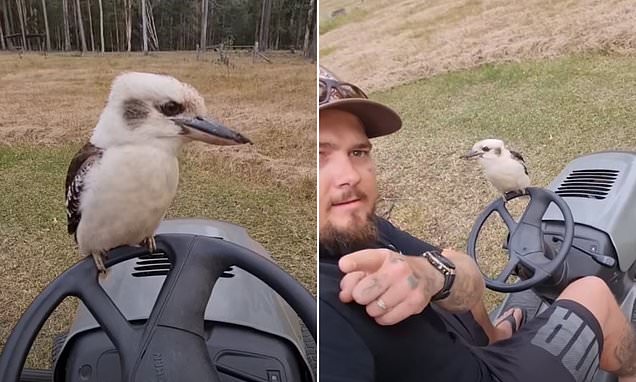
You are a GUI agent. You are given a task and a screenshot of the screen. Output one action in this format:
    pyautogui.click(x=<x>, y=<y>)
    Task: Click on the white border between picitures
    
    Given the screenshot: What is the action you would take?
    pyautogui.click(x=314, y=3), pyautogui.click(x=317, y=137), pyautogui.click(x=317, y=264), pyautogui.click(x=317, y=379)